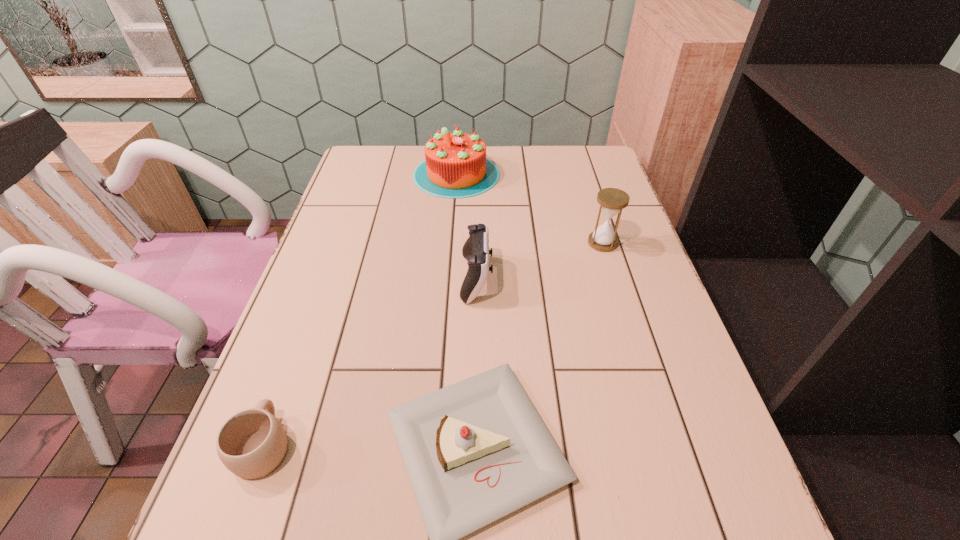
This screenshot has width=960, height=540. In order to click on vacant space situated 0.270m on the side of the mug with the handle in this screenshot , I will do `click(315, 305)`.

Locate an element on the screen. The height and width of the screenshot is (540, 960). blank space located on the side of the mug with the handle is located at coordinates (314, 308).

The width and height of the screenshot is (960, 540). Identify the location of blank area located 0.280m on the side of the mug with the handle. tap(316, 301).

Where is `object at the far edge`? object at the far edge is located at coordinates (455, 166).

This screenshot has width=960, height=540. Identify the location of object located at the left edge. (252, 443).

You are a GUI agent. You are given a task and a screenshot of the screen. Output one action in this format:
    pyautogui.click(x=<x>, y=<y>)
    Task: Click on the object that is at the right edge
    
    Given the screenshot: What is the action you would take?
    pyautogui.click(x=612, y=201)

The height and width of the screenshot is (540, 960). I want to click on free spot at the left edge of the desktop, so click(373, 232).

Locate an element on the screen. vacant area at the right edge of the desktop is located at coordinates (660, 454).

Where is `unoccupied area between the rightmost object and the taller cake`? The height and width of the screenshot is (540, 960). unoccupied area between the rightmost object and the taller cake is located at coordinates point(529,208).

At what (x,y) coordinates should I click in order to perform the action: click on blank region between the mug and the third farthest object. Please return your answer as a coordinate pair (x, y). Looking at the image, I should click on (370, 362).